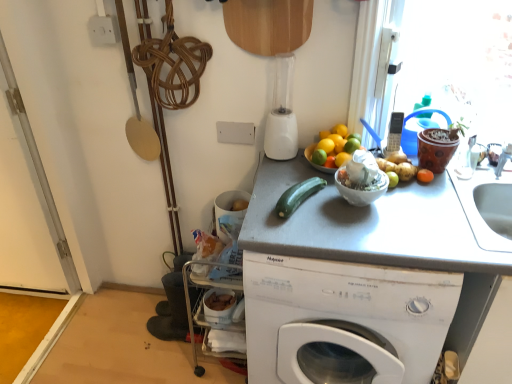
This screenshot has width=512, height=384. I want to click on free space to the left of white glossy bowl at center, so click(x=307, y=209).